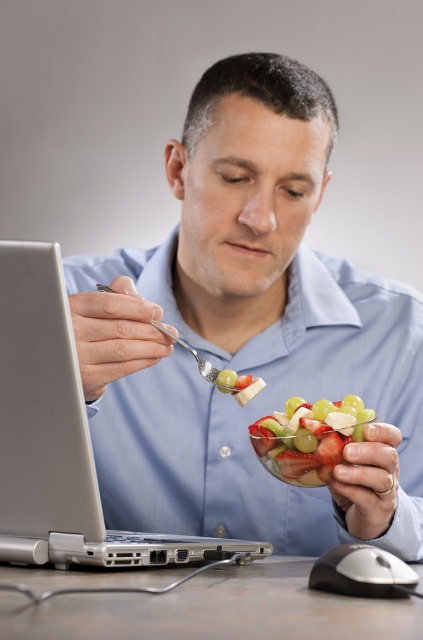
Between brown wooden table at lower center and translucent glass bowl of fruit salad at center, which one appears on the right side from the viewer's perspective?

translucent glass bowl of fruit salad at center

The image size is (423, 640). Describe the element at coordinates (217, 611) in the screenshot. I see `brown wooden table at lower center` at that location.

Measure the distance between brown wooden table at lower center and camera.

The distance of brown wooden table at lower center from camera is 15.71 inches.

This screenshot has width=423, height=640. I want to click on brown wooden table at lower center, so click(217, 611).

Can you confirm if silver metallic laptop at left is thinner than translucent glass bowl of fruit salad at center?

Incorrect, silver metallic laptop at left's width is not less than translucent glass bowl of fruit salad at center's.

Is silver metallic laptop at left closer to camera compared to translucent glass bowl of fruit salad at center?

Yes, it is in front of translucent glass bowl of fruit salad at center.

What do you see at coordinates (62, 436) in the screenshot? The height and width of the screenshot is (640, 423). I see `silver metallic laptop at left` at bounding box center [62, 436].

The width and height of the screenshot is (423, 640). What are the coordinates of `silver metallic laptop at left` in the screenshot? It's located at (62, 436).

Does translucent glass bowl of fruit salad at center have a greater height compared to silver metallic spoon at center?

In fact, translucent glass bowl of fruit salad at center may be shorter than silver metallic spoon at center.

Does translucent glass bowl of fruit salad at center have a lesser height compared to silver metallic spoon at center?

Correct, translucent glass bowl of fruit salad at center is not as tall as silver metallic spoon at center.

Is point (255, 442) behind point (208, 374)?

That is True.

At what (x,y) coordinates should I click in order to perform the action: click on translucent glass bowl of fruit salad at center. Please return your answer as a coordinate pair (x, y). The width and height of the screenshot is (423, 640). Looking at the image, I should click on (308, 438).